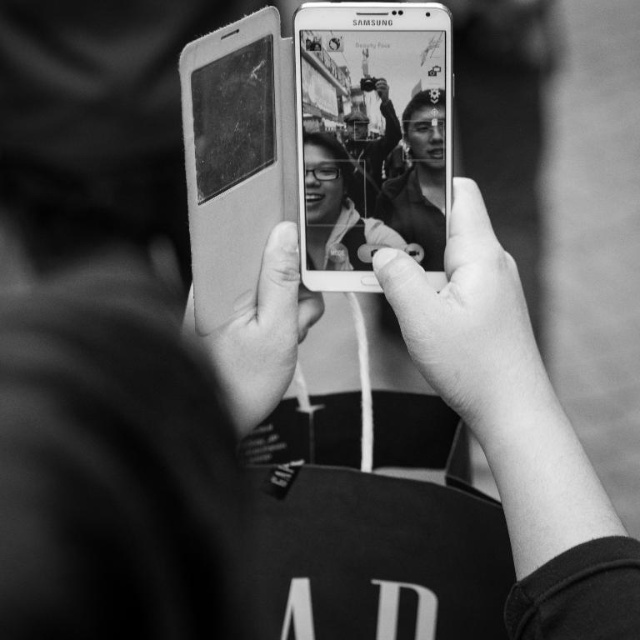
Question: Which point is closer to the camera?

Choices:
 (A) (211, 275)
 (B) (481, 352)

Answer: (B)

Question: Which object is closer to the camera taking this photo?

Choices:
 (A) smooth skin hand at center
 (B) smooth skin at center
 (C) leather-like white smartphone at upper center

Answer: (A)

Question: Which object appears farthest from the camera in this image?

Choices:
 (A) smooth skin at center
 (B) leather-like white smartphone at upper center
 (C) smooth skin hand at center

Answer: (A)

Question: Does leather-like white smartphone at upper center have a smaller size compared to smooth skin face at center?

Choices:
 (A) yes
 (B) no

Answer: (B)

Question: Observing the image, what is the correct spatial positioning of leather-like white smartphone at upper center in reference to smooth skin at center?

Choices:
 (A) above
 (B) below

Answer: (A)

Question: Does leather-like white smartphone at upper center appear on the right side of smooth skin face at center?

Choices:
 (A) yes
 (B) no

Answer: (B)